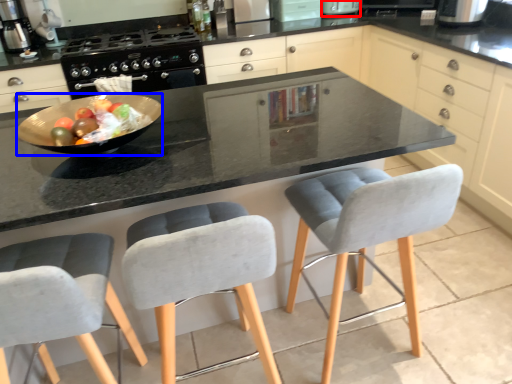
Question: Which point is closer to the camera, appliance (highlighted by a red box) or bowl (highlighted by a blue box)?

Choices:
 (A) appliance
 (B) bowl

Answer: (B)